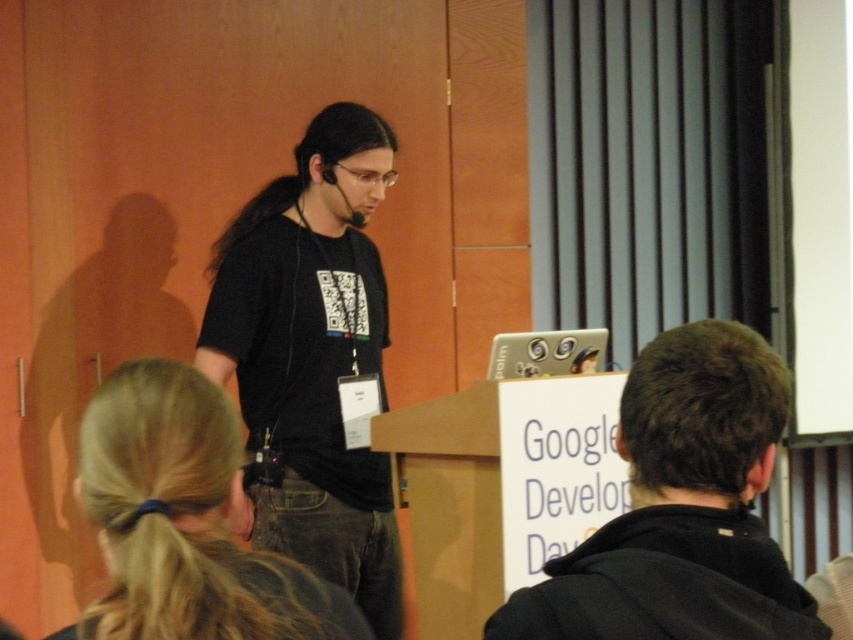
Does black matte jacket at center have a lesser height compared to blonde hair at upper left?

In fact, black matte jacket at center may be taller than blonde hair at upper left.

Is black matte jacket at center to the left of blonde hair at upper left from the viewer's perspective?

In fact, black matte jacket at center is to the right of blonde hair at upper left.

Is point (761, 490) positioned after point (143, 625)?

Yes.

Find the location of a particular element. The width and height of the screenshot is (853, 640). black matte jacket at center is located at coordinates (682, 508).

Is black matte t-shirt at center shorter than blonde hair at upper left?

Incorrect, black matte t-shirt at center's height does not fall short of blonde hair at upper left's.

Is point (273, 321) positioned in front of point (318, 636)?

No, (273, 321) is further to viewer.

Which is behind, point (238, 252) or point (128, 467)?

Point (238, 252)

Where is `black matte t-shirt at center`? black matte t-shirt at center is located at coordinates (312, 356).

Is black matte t-shirt at center to the left of black matte jacket at center from the viewer's perspective?

Yes, black matte t-shirt at center is to the left of black matte jacket at center.

Does black matte t-shirt at center appear over black matte jacket at center?

Yes.

Does point (294, 228) come behind point (762, 627)?

Yes, point (294, 228) is farther from viewer.

This screenshot has height=640, width=853. Identify the location of black matte t-shirt at center. (312, 356).